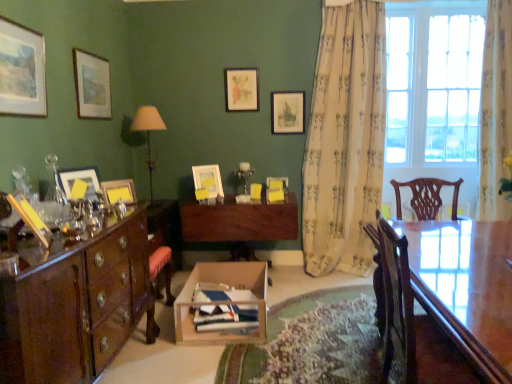
Question: Should I look upward or downward to see clear glass window at right?

Choices:
 (A) down
 (B) up

Answer: (B)

Question: Considering the relative sizes of matte pink picture frame at upper center, the 2th picture frame in the back-to-front sequence, and clear glass window at right in the image provided, is matte pink picture frame at upper center, the 2th picture frame in the back-to-front sequence, wider than clear glass window at right?

Choices:
 (A) yes
 (B) no

Answer: (B)

Question: Does matte pink picture frame at upper center, the seventh picture frame in the front-to-back sequence, contain clear glass window at right?

Choices:
 (A) yes
 (B) no

Answer: (B)

Question: Can you confirm if matte pink picture frame at upper center, the seventh picture frame in the front-to-back sequence, is smaller than clear glass window at right?

Choices:
 (A) no
 (B) yes

Answer: (B)

Question: From the image's perspective, would you say matte pink picture frame at upper center, the 2th picture frame in the back-to-front sequence, is positioned over clear glass window at right?

Choices:
 (A) no
 (B) yes

Answer: (B)

Question: Is the position of matte pink picture frame at upper center, the third picture frame in the right-to-left sequence, more distant than that of clear glass window at right?

Choices:
 (A) yes
 (B) no

Answer: (B)

Question: Is matte pink picture frame at upper center, the third picture frame in the right-to-left sequence, at the right side of clear glass window at right?

Choices:
 (A) no
 (B) yes

Answer: (A)

Question: Is matte paper picture frame at upper left, acting as the 4th picture frame starting from the front, bigger than matte black picture frame at upper center, the eighth picture frame positioned from the left?

Choices:
 (A) no
 (B) yes

Answer: (B)

Question: From a real-world perspective, does matte paper picture frame at upper left, the fifth picture frame when ordered from back to front, stand above matte black picture frame at upper center, the eighth picture frame positioned from the left?

Choices:
 (A) no
 (B) yes

Answer: (B)

Question: Does matte paper picture frame at upper left, the 7th picture frame positioned from the right, have a greater width compared to matte black picture frame at upper center, marked as the eighth picture frame in a front-to-back arrangement?

Choices:
 (A) yes
 (B) no

Answer: (B)

Question: Can you confirm if matte paper picture frame at upper left, acting as the 4th picture frame starting from the front, is shorter than matte black picture frame at upper center, which is counted as the first picture frame, starting from the back?

Choices:
 (A) yes
 (B) no

Answer: (B)

Question: Can you confirm if matte paper picture frame at upper left, the 7th picture frame positioned from the right, is taller than matte black picture frame at upper center, which ranks as the 1th picture frame in right-to-left order?

Choices:
 (A) no
 (B) yes

Answer: (B)

Question: Is matte paper picture frame at upper left, the fifth picture frame when ordered from back to front, behind matte black picture frame at upper center, which is counted as the first picture frame, starting from the back?

Choices:
 (A) yes
 (B) no

Answer: (B)

Question: Is polished wood cabinet at left beside matte white picture frame at left, marked as the 6th picture frame in a right-to-left arrangement?

Choices:
 (A) yes
 (B) no

Answer: (B)